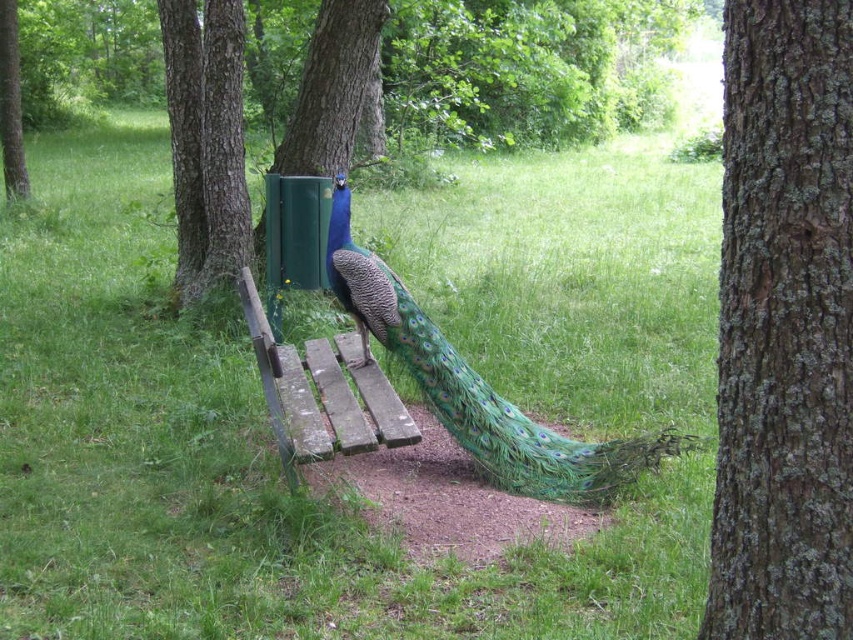
You are a gardener who needs to mow the green grass at center. However, you notice the weathered wood bench at center is in the way. Can you move the bench to access the grass?

The green grass at center is positioned over weathered wood bench at center, meaning the bench is underneath the grass area. Since the bench is under the grass, you can mow the grass without moving the bench as it is already accessible.

You are a photographer trying to capture the shiny blue peacock at center in the frame. Since the green grass at center is also in the foreground, will the peacock be fully visible in your photo?

The green grass at center is larger in size than the shiny blue peacock at center, so the peacock may be partially obscured by the grass in the photo.

You are planning to place a small garden ornament that requires a 2x2 feet space. Given the scene, can the green grass at center accommodate this ornament without overlapping the weathered wood bench at center?

The green grass at center might be wider than weathered wood bench at center, so there is a possibility that the grass area is wide enough to accommodate the 2x2 feet garden ornament without overlapping the bench. However, since the exact dimensions are not provided, it is recommended to measure the space before placing the ornament.